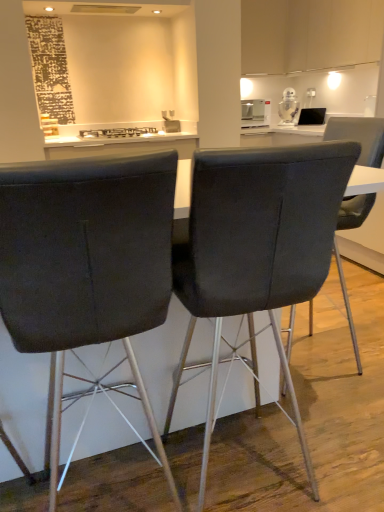
Question: Is velvet dark gray chair at center, placed as the third chair when sorted from left to right, thinner than matte black chair at center, positioned as the 1th chair in left-to-right order?

Choices:
 (A) no
 (B) yes

Answer: (A)

Question: Is velvet dark gray chair at center, placed as the third chair when sorted from left to right, bigger than matte black chair at center, arranged as the 3th chair when viewed from the right?

Choices:
 (A) no
 (B) yes

Answer: (B)

Question: Considering the relative sizes of velvet dark gray chair at center, placed as the third chair when sorted from left to right, and matte black chair at center, positioned as the 1th chair in left-to-right order, in the image provided, is velvet dark gray chair at center, placed as the third chair when sorted from left to right, smaller than matte black chair at center, positioned as the 1th chair in left-to-right order,?

Choices:
 (A) no
 (B) yes

Answer: (A)

Question: Is velvet dark gray chair at center, placed as the third chair when sorted from left to right, positioned beyond the bounds of matte black chair at center, arranged as the 3th chair when viewed from the right?

Choices:
 (A) yes
 (B) no

Answer: (A)

Question: Is velvet dark gray chair at center, which ranks as the first chair in right-to-left order, looking in the opposite direction of matte black chair at center, positioned as the 1th chair in left-to-right order?

Choices:
 (A) yes
 (B) no

Answer: (B)

Question: From the image's perspective, is velvet dark gray chair at center, placed as the third chair when sorted from left to right, positioned above or below white glossy robot at upper right, arranged as the 2th appliance when viewed from the left?

Choices:
 (A) above
 (B) below

Answer: (B)

Question: In terms of height, does velvet dark gray chair at center, placed as the third chair when sorted from left to right, look taller or shorter compared to white glossy robot at upper right, the 1th appliance when ordered from right to left?

Choices:
 (A) tall
 (B) short

Answer: (A)

Question: Considering their positions, is velvet dark gray chair at center, placed as the third chair when sorted from left to right, located in front of or behind white glossy robot at upper right, arranged as the 2th appliance when viewed from the left?

Choices:
 (A) behind
 (B) front

Answer: (B)

Question: Considering the positions of point (357, 130) and point (291, 117), is point (357, 130) closer or farther from the camera than point (291, 117)?

Choices:
 (A) closer
 (B) farther

Answer: (A)

Question: Is matte black chair at center, positioned as the 1th chair in left-to-right order, taller or shorter than white glossy robot at upper right, the 1th appliance when ordered from right to left?

Choices:
 (A) short
 (B) tall

Answer: (B)

Question: Based on their positions, is matte black chair at center, positioned as the 1th chair in left-to-right order, located to the left or right of white glossy robot at upper right, the 1th appliance when ordered from right to left?

Choices:
 (A) left
 (B) right

Answer: (A)

Question: Considering the positions of matte black chair at center, positioned as the 1th chair in left-to-right order, and white glossy robot at upper right, arranged as the 2th appliance when viewed from the left, in the image, is matte black chair at center, positioned as the 1th chair in left-to-right order, wider or thinner than white glossy robot at upper right, arranged as the 2th appliance when viewed from the left,?

Choices:
 (A) wide
 (B) thin

Answer: (A)

Question: Is matte black chair at center, positioned as the 1th chair in left-to-right order, in front of or behind white glossy robot at upper right, arranged as the 2th appliance when viewed from the left, in the image?

Choices:
 (A) front
 (B) behind

Answer: (A)

Question: Based on their positions, is satin silver toaster at upper center, acting as the second appliance starting from the right, located to the left or right of white glossy robot at upper right, arranged as the 2th appliance when viewed from the left?

Choices:
 (A) right
 (B) left

Answer: (B)

Question: Relative to white glossy robot at upper right, arranged as the 2th appliance when viewed from the left, is satin silver toaster at upper center, marked as the 1th appliance in a left-to-right arrangement, in front or behind?

Choices:
 (A) front
 (B) behind

Answer: (A)